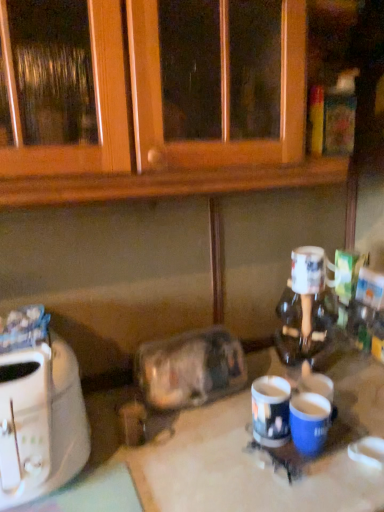
This screenshot has width=384, height=512. Find the location of `vacant area that is in front of transparent plastic container at center`. vacant area that is in front of transparent plastic container at center is located at coordinates (190, 441).